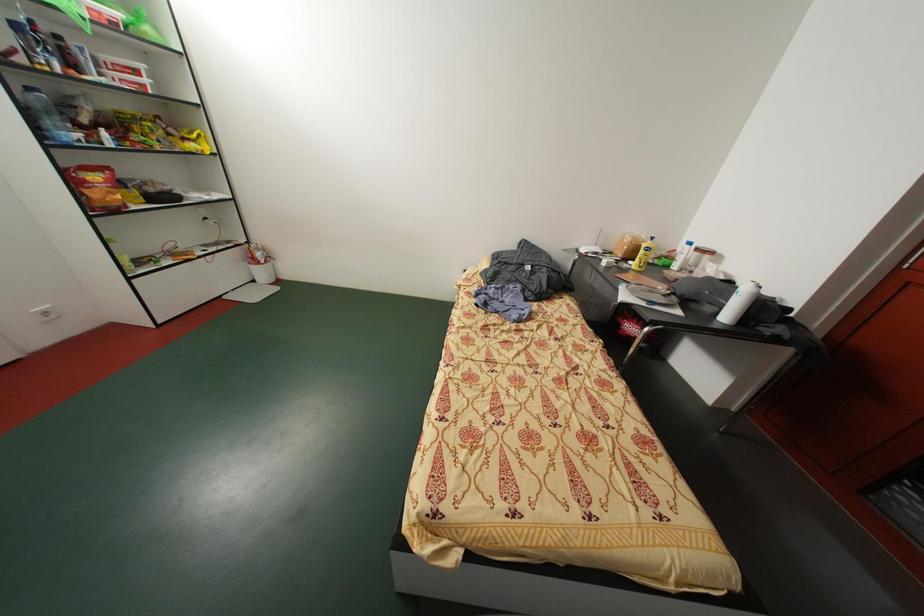
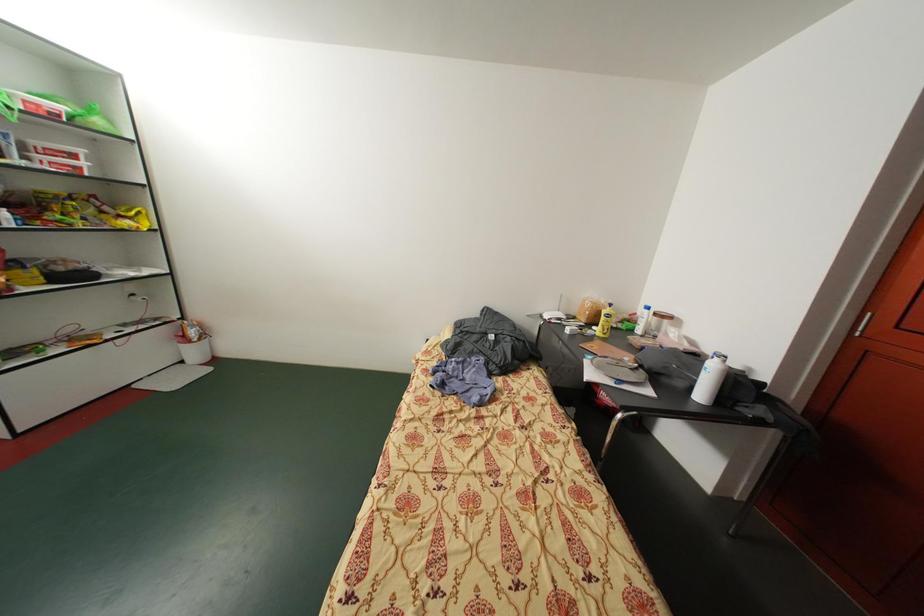
In a continuous first-person perspective shot, in which direction is the camera moving?

The cameraman moved toward right, forward.